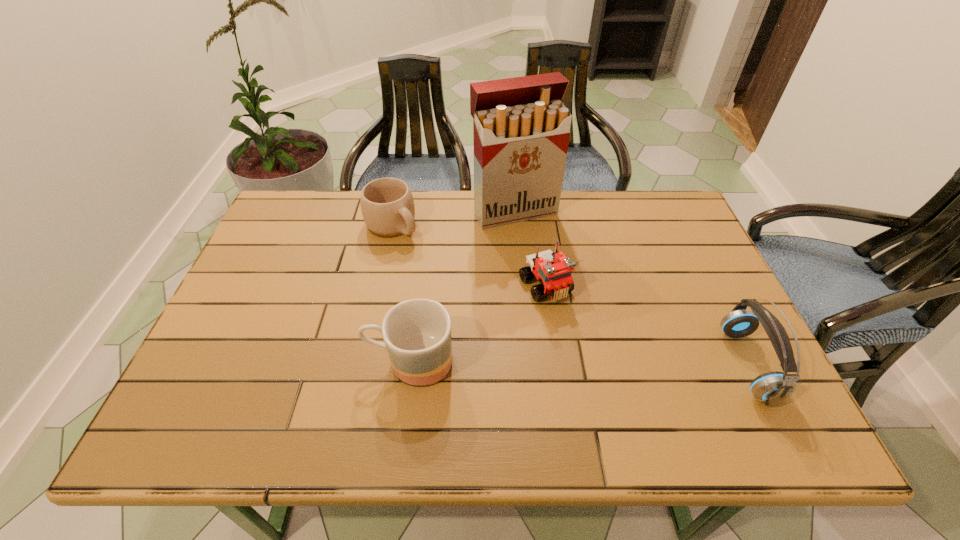
Where is `vacant space on the desktop that is between the nearer mug and the headset and is positioned on the side of the farther mug with the handle`? vacant space on the desktop that is between the nearer mug and the headset and is positioned on the side of the farther mug with the handle is located at coordinates (564, 363).

Where is `vacant space on the desktop that is between the nearer mug and the rightmost object and is positioned on the front-facing side of the third nearest object`? vacant space on the desktop that is between the nearer mug and the rightmost object and is positioned on the front-facing side of the third nearest object is located at coordinates (597, 363).

Where is `vacant space on the desktop that is between the nearer mug and the headset and is positioned with the lid open on the tallest object`? vacant space on the desktop that is between the nearer mug and the headset and is positioned with the lid open on the tallest object is located at coordinates (604, 363).